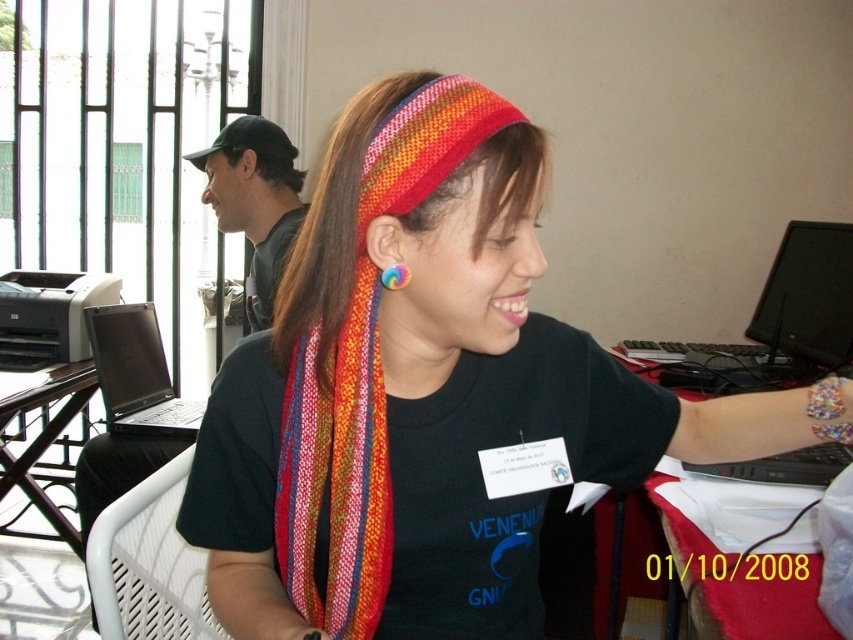
You are organizing a craft fair and need to display two knitted items. The knitted fabric headband at center and the knitted fabric scarf at center are both on a table. Which item is placed lower on the table?

The knitted fabric headband at center is positioned under the knitted fabric scarf at center, so it is placed lower on the table.

You are a person who wants to place a 5 feet long object between the red cloth at right and the rainbow fabric earring at ear. Is there enough space?

The distance between the red cloth at right and the rainbow fabric earring at ear is 4.89 feet, which is slightly shorter than the 5 feet long object. Therefore, there isn not enough space to place the object between them.

You are standing in front of the desk where the woman with the colorful woven headband is working. There is a point marked at coordinates (428, 392). Where exactly is this point located on the scene?

The point at coordinates (428, 392) is located on the knitted fabric headband at center.